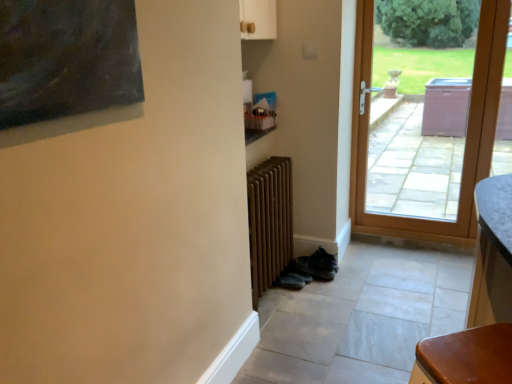
Question: Should I look upward or downward to see brown wooden door at right?

Choices:
 (A) down
 (B) up

Answer: (B)

Question: Is brown wooden radiator at center aimed at brown wooden door at right?

Choices:
 (A) yes
 (B) no

Answer: (B)

Question: From the image's perspective, is brown wooden radiator at center on brown wooden door at right?

Choices:
 (A) no
 (B) yes

Answer: (A)

Question: Does brown wooden radiator at center lie behind brown wooden door at right?

Choices:
 (A) yes
 (B) no

Answer: (B)

Question: Can you confirm if brown wooden radiator at center is smaller than brown wooden door at right?

Choices:
 (A) no
 (B) yes

Answer: (B)

Question: Is brown wooden radiator at center to the left of brown wooden door at right from the viewer's perspective?

Choices:
 (A) no
 (B) yes

Answer: (B)

Question: From a real-world perspective, is brown wooden radiator at center positioned over brown wooden door at right based on gravity?

Choices:
 (A) no
 (B) yes

Answer: (A)

Question: Can you confirm if brown wooden door at right is shorter than brown wooden radiator at center?

Choices:
 (A) no
 (B) yes

Answer: (A)

Question: Is brown wooden door at right outside of brown wooden radiator at center?

Choices:
 (A) yes
 (B) no

Answer: (A)

Question: From the image's perspective, is brown wooden door at right on top of brown wooden radiator at center?

Choices:
 (A) no
 (B) yes

Answer: (B)

Question: Can you confirm if brown wooden door at right is thinner than brown wooden radiator at center?

Choices:
 (A) yes
 (B) no

Answer: (A)

Question: Is brown wooden door at right in front of brown wooden radiator at center?

Choices:
 (A) no
 (B) yes

Answer: (A)

Question: Is brown wooden radiator at center completely or partially inside brown wooden door at right?

Choices:
 (A) yes
 (B) no

Answer: (B)

Question: In terms of height, does brown wooden door at right look taller or shorter compared to brown wooden radiator at center?

Choices:
 (A) tall
 (B) short

Answer: (A)